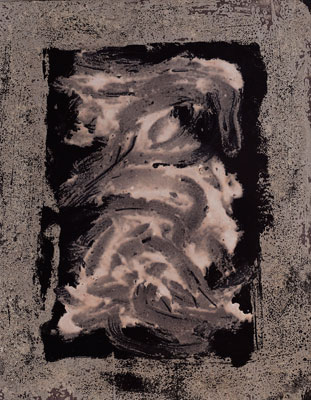
I want to click on corners, so click(x=256, y=352), click(x=46, y=357), click(x=49, y=48), click(x=257, y=42).